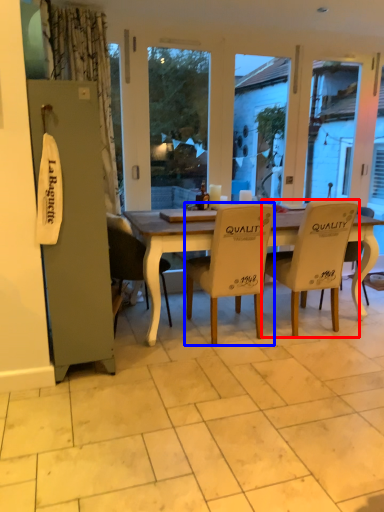
Question: Which object appears farthest to the camera in this image, chair (highlighted by a red box) or chair (highlighted by a blue box)?

Choices:
 (A) chair
 (B) chair

Answer: (A)